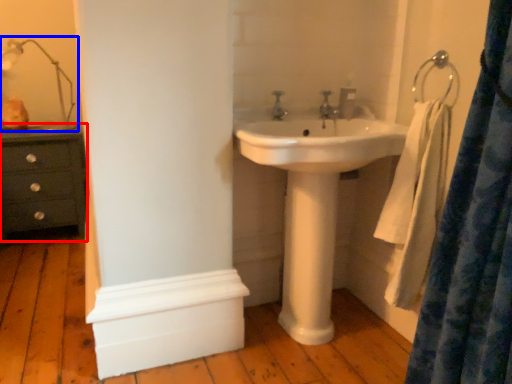
Question: Which object is further to the camera taking this photo, chest of drawers (highlighted by a red box) or table lamp (highlighted by a blue box)?

Choices:
 (A) chest of drawers
 (B) table lamp

Answer: (A)